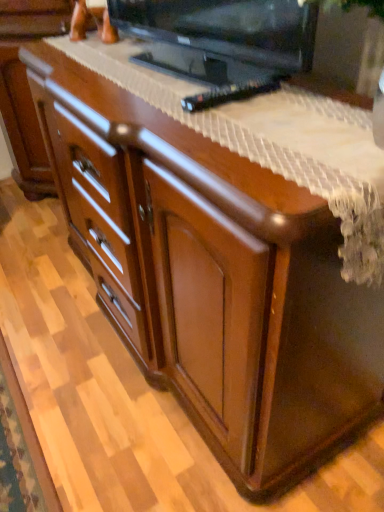
Locate an element on the screen. This screenshot has width=384, height=512. vacant point to the left of black glossy television at upper center is located at coordinates (101, 74).